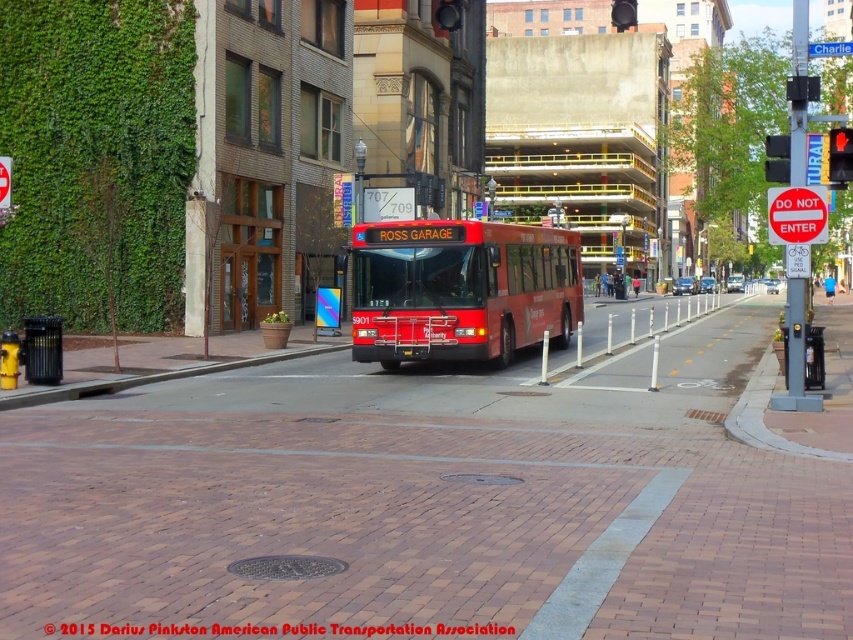
Who is taller, red matte bus at center or red glass traffic light at upper right?

With more height is red matte bus at center.

Is red matte bus at center further to the viewer compared to red glass traffic light at upper right?

Yes, it is behind red glass traffic light at upper right.

Does point (467, 310) come closer to viewer compared to point (840, 129)?

That is False.

Where is `red matte bus at center`? The height and width of the screenshot is (640, 853). red matte bus at center is located at coordinates (461, 289).

Is brick pavement at center taller than blue metallic street sign at upper center?

In fact, brick pavement at center may be shorter than blue metallic street sign at upper center.

Can you confirm if brick pavement at center is positioned above blue metallic street sign at upper center?

Incorrect, brick pavement at center is not positioned above blue metallic street sign at upper center.

Is point (71, 621) in front of point (807, 45)?

Yes, it is.

This screenshot has height=640, width=853. In order to click on brick pavement at center in this screenshot , I will do `click(433, 497)`.

Is brick at center shorter than red glass traffic light at upper right?

Yes.

Is brick at center wider than red glass traffic light at upper right?

Yes.

The height and width of the screenshot is (640, 853). Describe the element at coordinates (154, 378) in the screenshot. I see `brick at center` at that location.

Where is `brick at center`? Image resolution: width=853 pixels, height=640 pixels. brick at center is located at coordinates (154, 378).